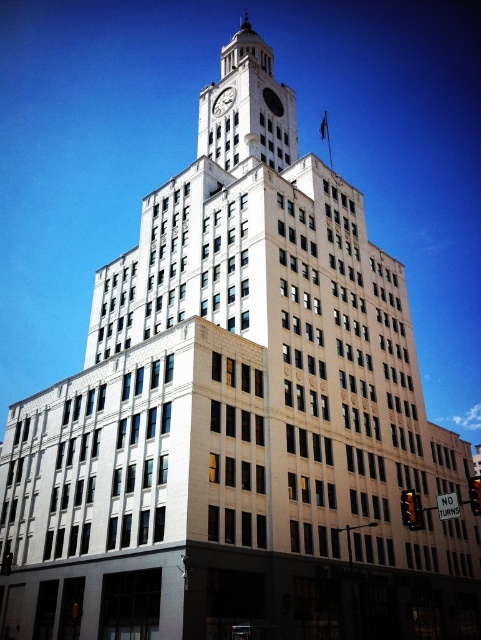
Question: Can you confirm if white stone clock tower at center is bigger than white marble clock at upper center?

Choices:
 (A) no
 (B) yes

Answer: (B)

Question: Among these objects, which one is farthest from the camera?

Choices:
 (A) white stone clock tower at center
 (B) white marble clock at upper center

Answer: (B)

Question: Does white stone clock tower at center have a greater width compared to white marble clock at upper center?

Choices:
 (A) no
 (B) yes

Answer: (B)

Question: Which point is farther from the camera taking this photo?

Choices:
 (A) (217, 108)
 (B) (235, 81)

Answer: (A)

Question: Is white stone clock tower at center in front of white marble clock at upper center?

Choices:
 (A) yes
 (B) no

Answer: (A)

Question: Which point appears closest to the camera in this image?

Choices:
 (A) (262, 122)
 (B) (220, 99)

Answer: (A)